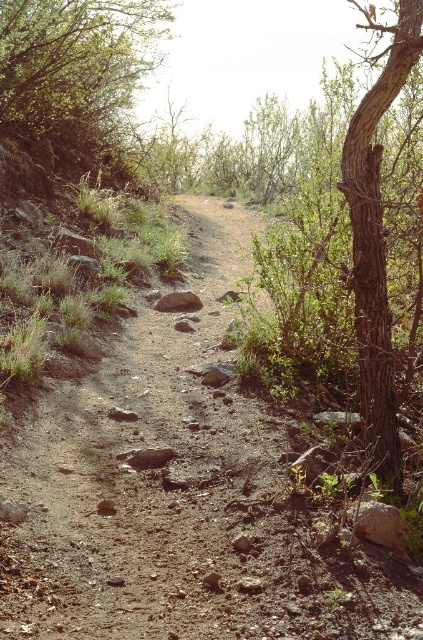
Question: Among these points, which one is nearest to the camera?

Choices:
 (A) [235, 504]
 (B) [357, 227]

Answer: (A)

Question: Is dusty brown dirt track at center to the right of green leafy tree at upper left from the viewer's perspective?

Choices:
 (A) yes
 (B) no

Answer: (A)

Question: Which point is farther to the camera?

Choices:
 (A) [173, 307]
 (B) [76, 532]
 (C) [384, 388]
 (D) [33, 13]

Answer: (D)

Question: Is brown rough bark tree at right to the left of brown rough rock at center from the viewer's perspective?

Choices:
 (A) yes
 (B) no

Answer: (B)

Question: Does dusty brown dirt track at center appear on the left side of green leafy tree at upper left?

Choices:
 (A) yes
 (B) no

Answer: (B)

Question: Among these points, which one is farthest from the camera?

Choices:
 (A) (250, 522)
 (B) (101, 68)

Answer: (B)